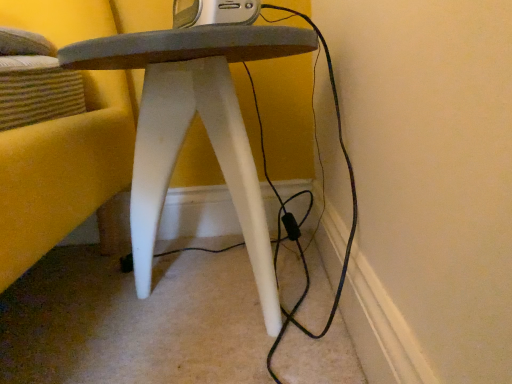
Question: Is white matte stool at center in front of or behind silver metallic radio at upper center in the image?

Choices:
 (A) behind
 (B) front

Answer: (B)

Question: From a real-world perspective, is white matte stool at center positioned above or below silver metallic radio at upper center?

Choices:
 (A) above
 (B) below

Answer: (B)

Question: Would you say white matte stool at center is to the left or to the right of silver metallic radio at upper center in the picture?

Choices:
 (A) right
 (B) left

Answer: (B)

Question: From their relative heights in the image, would you say silver metallic radio at upper center is taller or shorter than white matte stool at center?

Choices:
 (A) short
 (B) tall

Answer: (A)

Question: Is point (178, 13) positioned closer to the camera than point (152, 208)?

Choices:
 (A) closer
 (B) farther

Answer: (A)

Question: From a real-world perspective, is silver metallic radio at upper center physically located above or below white matte stool at center?

Choices:
 (A) below
 (B) above

Answer: (B)

Question: From the image's perspective, is silver metallic radio at upper center located above or below white matte stool at center?

Choices:
 (A) above
 (B) below

Answer: (A)